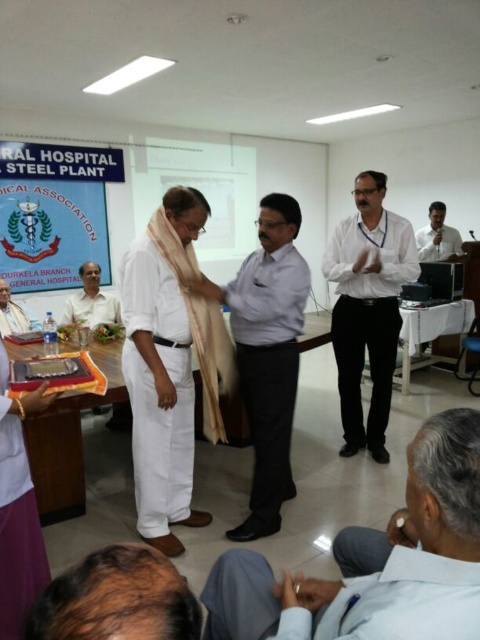
Is point (124, 420) in front of point (444, 257)?

Yes.

Which of these two, matte white shirt at center or light brown shirt at upper right, stands shorter?

matte white shirt at center

Between point (103, 305) and point (455, 256), which one is positioned behind?

Positioned behind is point (455, 256).

You are a GUI agent. You are given a task and a screenshot of the screen. Output one action in this format:
    pyautogui.click(x=<x>, y=<y>)
    Task: Click on the matte white shirt at center
    The height and width of the screenshot is (640, 480).
    Given the screenshot: What is the action you would take?
    pyautogui.click(x=91, y=301)

The image size is (480, 640). What do you see at coordinates (169, 365) in the screenshot?
I see `white cotton dhoti at center` at bounding box center [169, 365].

At what (x,y) coordinates should I click in order to perform the action: click on white cotton dhoti at center. Please return your answer as a coordinate pair (x, y). The width and height of the screenshot is (480, 640). Looking at the image, I should click on (169, 365).

Who is more forward, (x=132, y=401) or (x=336, y=314)?

Point (x=132, y=401) is more forward.

Identify the location of white cotton dhoti at center. (169, 365).

Is light brown shirt at upper right further to camera compared to white cotton shirt at lower left?

Yes, it is.

How much distance is there between light brown shirt at upper right and white cotton shirt at lower left?

A distance of 12.66 feet exists between light brown shirt at upper right and white cotton shirt at lower left.

Which is in front, point (442, 259) or point (25, 320)?

Point (25, 320) is in front.

You are a GUI agent. You are given a task and a screenshot of the screen. Output one action in this format:
    pyautogui.click(x=<x>, y=<y>)
    Task: Click on the light brown shirt at upper right
    Image resolution: width=480 pixels, height=640 pixels.
    Given the screenshot: What is the action you would take?
    pyautogui.click(x=437, y=236)